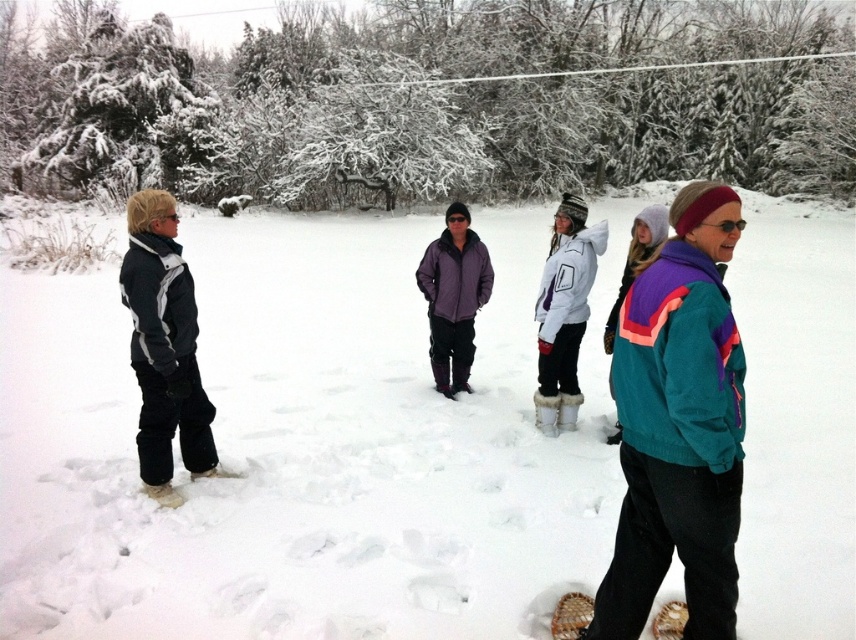
You are a photographer trying to capture a group photo of the five people in the snowy scene. You want to ensure that both the dark gray fleece jacket at left and the white woven snowshoe at lower left are clearly visible in the frame. Given their sizes, which object should you focus on to ensure both are in focus?

The dark gray fleece jacket at left is much taller than the white woven snowshoe at lower left. To ensure both are in focus, you should focus on the taller object, which is the dark gray fleece jacket at left, as it will keep the depth of field sufficient for the smaller snowshoe.

You are planning to take a photo of the white fleece jacket at center and the white woven snowshoe at lower left. Which object should you focus on first if you want to capture both in the same frame without moving the camera?

The white fleece jacket at center is located above the white woven snowshoe at lower left, so you should focus on the white fleece jacket at center first to ensure both are in the frame without moving the camera.